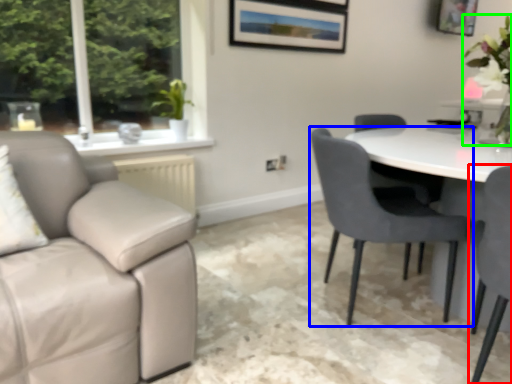
Question: Estimate the real-world distances between objects in this image. Which object is closer to chair (highlighted by a red box), chair (highlighted by a blue box) or floral arrangement (highlighted by a green box)?

Choices:
 (A) chair
 (B) floral arrangement

Answer: (A)